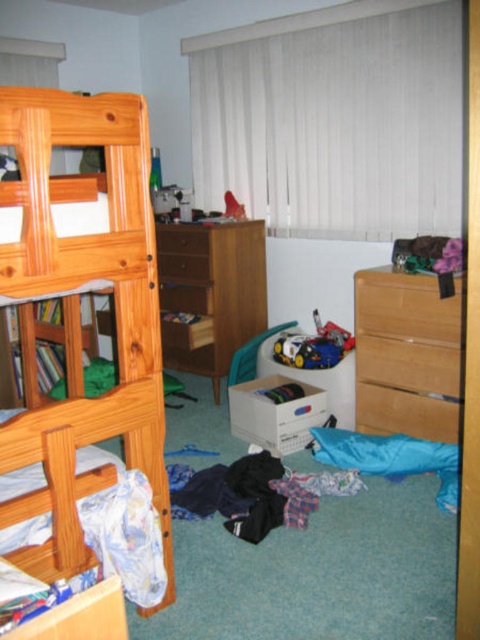
You are helping to organize the child bedroom. You need to place a large toy box that requires a bigger surface. Which of the two dressers, the light brown wooden dresser at right or the wooden dresser at center, should you choose to place it?

The wooden dresser at center is larger than the light brown wooden dresser at right, so you should choose the wooden dresser at center to place the large toy box.

You are a parent trying to clean up the child bedroom. You are currently standing at the light brown wooden dresser at right. You want to pick up the blue sleeping bag or blanket to the right of the pile of clothes. Can you reach it without moving from the dresser?

The light brown wooden dresser at right is 2.64 meters away from the viewer. Since the blue sleeping bag or blanket is to the right of the pile of clothes, which is in the center of the room, the distance between the dresser and the sleeping bag may be more than arm length. Therefore, you cannot reach it without moving from the dresser.

You are standing in the child bedroom and want to reach the point marked as point [78,541]. If you have a 1.5 meter long stick, can you reach it?

The point [78,541] is 1.59 meters away from camera, so the 1.5 meter long stick is not long enough to reach it.